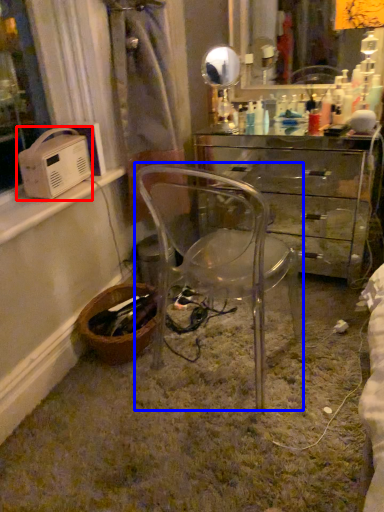
Question: Which of the following is the closest to the observer, appliance (highlighted by a red box) or chair (highlighted by a blue box)?

Choices:
 (A) appliance
 (B) chair

Answer: (B)